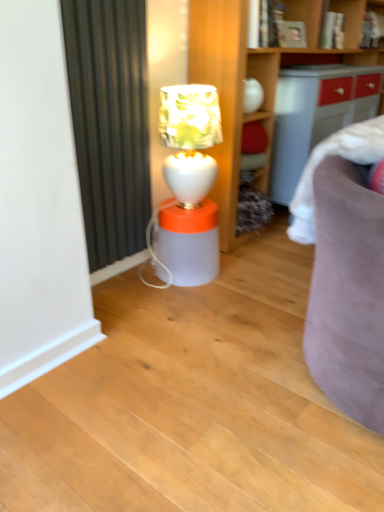
Find the location of a particular element. The height and width of the screenshot is (512, 384). white glossy table lamp at center is located at coordinates (190, 139).

Image resolution: width=384 pixels, height=512 pixels. Describe the element at coordinates (190, 139) in the screenshot. I see `white glossy table lamp at center` at that location.

Measure the distance between white glossy table lamp at center and camera.

The distance of white glossy table lamp at center from camera is 5.80 feet.

What is the approximate width of white glossy table lamp at center?

27.84 centimeters.

What is the approximate height of translucent plastic lamp at center?

36.86 centimeters.

The width and height of the screenshot is (384, 512). What do you see at coordinates (187, 243) in the screenshot?
I see `translucent plastic lamp at center` at bounding box center [187, 243].

Locate an element on the screen. The height and width of the screenshot is (512, 384). translucent plastic lamp at center is located at coordinates (187, 243).

This screenshot has height=512, width=384. In order to click on white glossy table lamp at center in this screenshot , I will do `click(190, 139)`.

Based on the photo, can you confirm if translucent plastic lamp at center is positioned to the right of white glossy table lamp at center?

No, translucent plastic lamp at center is not to the right of white glossy table lamp at center.

Based on the photo, is translucent plastic lamp at center in front of or behind white glossy table lamp at center in the image?

In the image, translucent plastic lamp at center appears behind white glossy table lamp at center.

Considering the points (208, 201) and (186, 189), which point is behind, point (208, 201) or point (186, 189)?

The point (208, 201) is more distant.

From the image's perspective, which is below, translucent plastic lamp at center or white glossy table lamp at center?

translucent plastic lamp at center appears lower in the image.

From a real-world perspective, is translucent plastic lamp at center positioned above or below white glossy table lamp at center?

translucent plastic lamp at center is situated lower than white glossy table lamp at center in the real world.

Can you confirm if translucent plastic lamp at center is wider than white glossy table lamp at center?

Correct, the width of translucent plastic lamp at center exceeds that of white glossy table lamp at center.

Considering the sizes of translucent plastic lamp at center and white glossy table lamp at center in the image, is translucent plastic lamp at center taller or shorter than white glossy table lamp at center?

Considering their sizes, translucent plastic lamp at center has less height than white glossy table lamp at center.

Between translucent plastic lamp at center and white glossy table lamp at center, which one has smaller size?

translucent plastic lamp at center.

Would you say translucent plastic lamp at center is outside white glossy table lamp at center?

That's correct, translucent plastic lamp at center is outside of white glossy table lamp at center.

Is translucent plastic lamp at center touching white glossy table lamp at center?

They are not placed beside each other.

Is translucent plastic lamp at center looking in the opposite direction of white glossy table lamp at center?

No, translucent plastic lamp at center is not facing the opposite direction of white glossy table lamp at center.

How different are the orientations of translucent plastic lamp at center and white glossy table lamp at center in degrees?

The facing directions of translucent plastic lamp at center and white glossy table lamp at center are 0.00124 degrees apart.

This screenshot has width=384, height=512. In order to click on table located below the white glossy table lamp at center (from the image's perspective) in this screenshot , I will do `click(187, 243)`.

Is white glossy table lamp at center to the right of translucent plastic lamp at center from the viewer's perspective?

Yes.

Considering their positions, is white glossy table lamp at center located in front of or behind translucent plastic lamp at center?

white glossy table lamp at center is in front of translucent plastic lamp at center.

Which is closer, (x=184, y=197) or (x=195, y=285)?

Positioned in front is point (x=184, y=197).

From the image's perspective, is white glossy table lamp at center on top of translucent plastic lamp at center?

Correct, white glossy table lamp at center appears higher than translucent plastic lamp at center in the image.

From a real-world perspective, which is physically below, white glossy table lamp at center or translucent plastic lamp at center?

translucent plastic lamp at center, from a real-world perspective.

Which of these two, white glossy table lamp at center or translucent plastic lamp at center, is thinner?

white glossy table lamp at center.

From their relative heights in the image, would you say white glossy table lamp at center is taller or shorter than translucent plastic lamp at center?

Clearly, white glossy table lamp at center is taller compared to translucent plastic lamp at center.

Considering the relative sizes of white glossy table lamp at center and translucent plastic lamp at center in the image provided, is white glossy table lamp at center bigger than translucent plastic lamp at center?

Correct, white glossy table lamp at center is larger in size than translucent plastic lamp at center.

Is white glossy table lamp at center situated inside translucent plastic lamp at center or outside?

The correct answer is: outside.

Is white glossy table lamp at center not close to translucent plastic lamp at center?

white glossy table lamp at center is near translucent plastic lamp at center, not far away.

Is white glossy table lamp at center oriented away from translucent plastic lamp at center?

No, translucent plastic lamp at center is not at the back of white glossy table lamp at center.

How many degrees apart are the facing directions of white glossy table lamp at center and translucent plastic lamp at center?

white glossy table lamp at center and translucent plastic lamp at center are facing 0.00124 degrees away from each other.

At what (x,y) coordinates should I click in order to perform the action: click on table below the white glossy table lamp at center (from a real-world perspective). Please return your answer as a coordinate pair (x, y). The height and width of the screenshot is (512, 384). Looking at the image, I should click on (187, 243).

What are the coordinates of `table below the white glossy table lamp at center (from the image's perspective)` in the screenshot? It's located at (187, 243).

I want to click on table lamp above the translucent plastic lamp at center (from a real-world perspective), so click(190, 139).